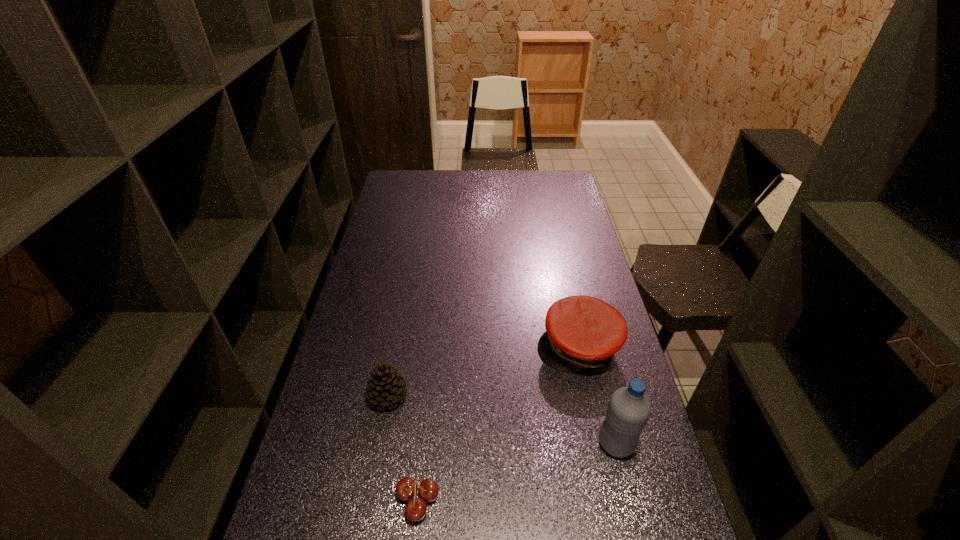
What are the coordinates of `blank area in the image that satisfies the following two spatial constraints: 1. on the front side of the farthest object; 2. on the right side of the water bottle` in the screenshot? It's located at (600, 443).

Find the location of a particular element. free location that satisfies the following two spatial constraints: 1. on the front side of the second object from left to right; 2. on the leaves of the pinecone is located at coordinates (369, 497).